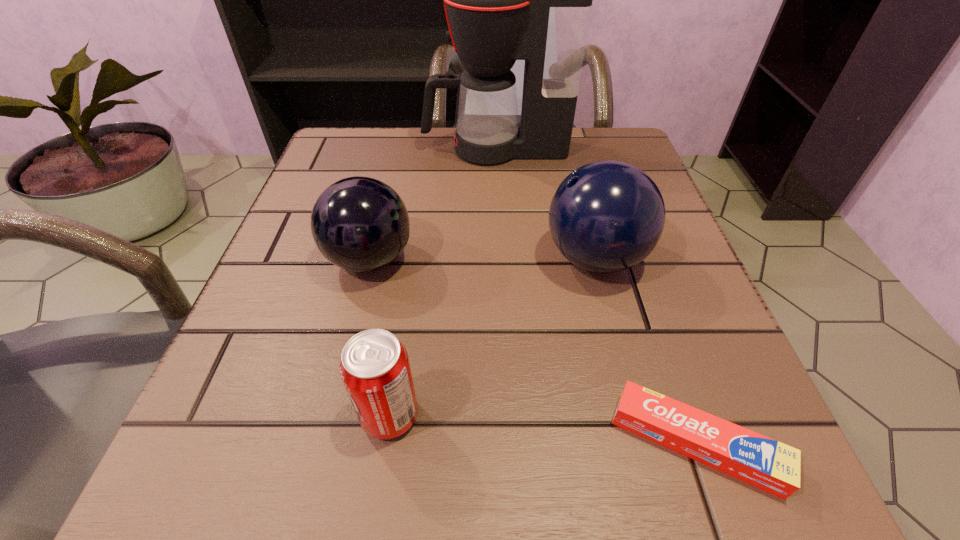
Where is `free region located on the surface of the right bowling ball near the finger holes`? The image size is (960, 540). free region located on the surface of the right bowling ball near the finger holes is located at coordinates (445, 258).

Where is `vacant region located on the surface of the right bowling ball near the finger holes`? vacant region located on the surface of the right bowling ball near the finger holes is located at coordinates (299, 258).

This screenshot has height=540, width=960. Identify the location of vacant space located 0.200m on the side of the shorter bowling ball with the finger holes. (537, 260).

The width and height of the screenshot is (960, 540). I want to click on free space located on the back of the soda, so click(404, 321).

At what (x,y) coordinates should I click in order to perform the action: click on vacant space located on the back of the shortest object. Please return your answer as a coordinate pair (x, y). The width and height of the screenshot is (960, 540). Looking at the image, I should click on (614, 208).

The image size is (960, 540). I want to click on object located at the far edge, so click(x=505, y=0).

This screenshot has width=960, height=540. Find the location of `soda that is at the near edge`. soda that is at the near edge is located at coordinates (374, 367).

I want to click on toothpaste that is at the near edge, so click(772, 466).

Identify the location of object located at the left edge. (360, 224).

At what (x,y) coordinates should I click in order to perform the action: click on coffee maker that is positioned at the right edge. Please return your answer as a coordinate pair (x, y). The image size is (960, 540). Looking at the image, I should click on (505, 0).